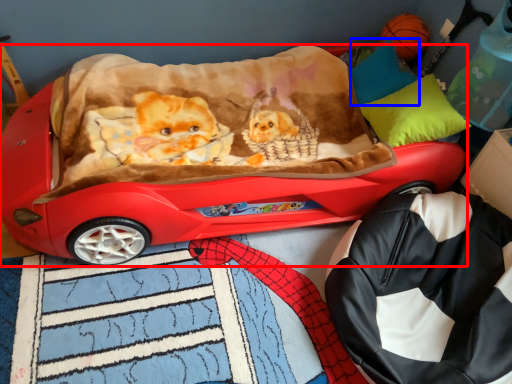
Question: Which object is further to the camera taking this photo, car (highlighted by a red box) or pillow (highlighted by a blue box)?

Choices:
 (A) car
 (B) pillow

Answer: (B)